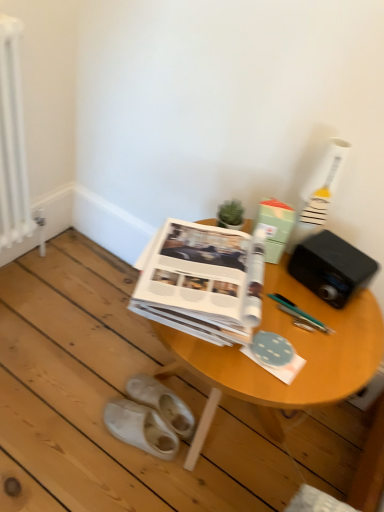
Question: Is white metallic radiator at left behind green matte paper at center, the second paperback book positioned from the left?

Choices:
 (A) no
 (B) yes

Answer: (A)

Question: From a real-world perspective, is white metallic radiator at left positioned over green matte paper at center, the first paperback book from the right, based on gravity?

Choices:
 (A) no
 (B) yes

Answer: (A)

Question: Is white metallic radiator at left to the left of green matte paper at center, the first paperback book from the right, from the viewer's perspective?

Choices:
 (A) yes
 (B) no

Answer: (A)

Question: From the image's perspective, is white metallic radiator at left beneath green matte paper at center, the second paperback book positioned from the left?

Choices:
 (A) yes
 (B) no

Answer: (B)

Question: Is white metallic radiator at left smaller than green matte paper at center, the second paperback book positioned from the left?

Choices:
 (A) no
 (B) yes

Answer: (A)

Question: Choose the correct answer: Is black plastic speaker at upper right inside white paper at center, marked as the 1th paperback book in a left-to-right arrangement, or outside it?

Choices:
 (A) inside
 (B) outside

Answer: (B)

Question: Is black plastic speaker at upper right in front of or behind white paper at center, marked as the 1th paperback book in a left-to-right arrangement, in the image?

Choices:
 (A) front
 (B) behind

Answer: (B)

Question: From their relative heights in the image, would you say black plastic speaker at upper right is taller or shorter than white paper at center, marked as the 1th paperback book in a left-to-right arrangement?

Choices:
 (A) tall
 (B) short

Answer: (A)

Question: Is point (299, 251) positioned closer to the camera than point (182, 298)?

Choices:
 (A) closer
 (B) farther

Answer: (B)

Question: From the image's perspective, is black plastic speaker at upper right above or below white metallic radiator at left?

Choices:
 (A) above
 (B) below

Answer: (B)

Question: From a real-world perspective, is black plastic speaker at upper right above or below white metallic radiator at left?

Choices:
 (A) below
 (B) above

Answer: (B)

Question: Is black plastic speaker at upper right situated inside white metallic radiator at left or outside?

Choices:
 (A) outside
 (B) inside

Answer: (A)

Question: Considering the positions of black plastic speaker at upper right and white metallic radiator at left in the image, is black plastic speaker at upper right wider or thinner than white metallic radiator at left?

Choices:
 (A) thin
 (B) wide

Answer: (B)

Question: Is green matte paper at center, the first paperback book from the right, wider or thinner than black plastic speaker at upper right?

Choices:
 (A) thin
 (B) wide

Answer: (A)

Question: Considering the positions of point (258, 216) and point (326, 281), is point (258, 216) closer or farther from the camera than point (326, 281)?

Choices:
 (A) closer
 (B) farther

Answer: (B)